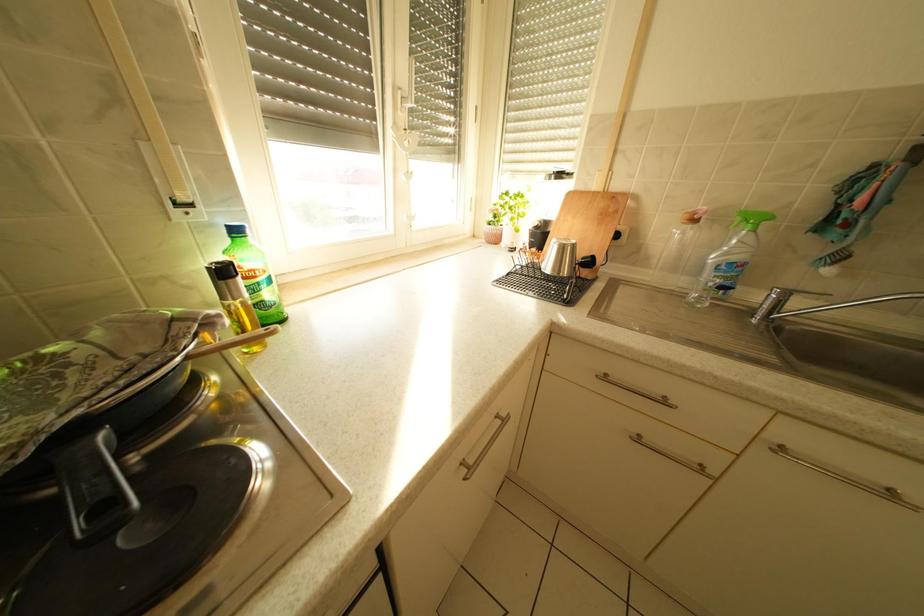
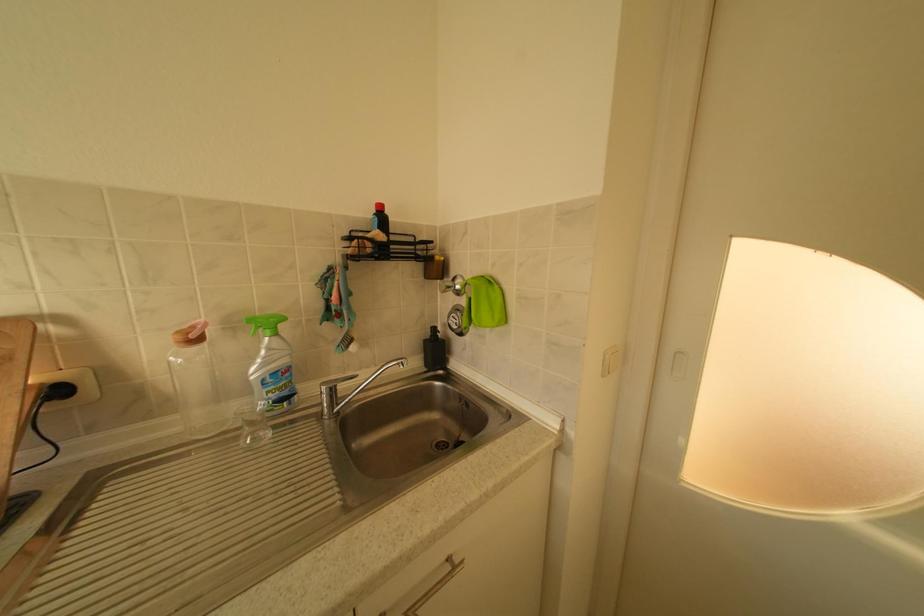
Question: Based on the continuous images, in which direction is the camera rotating? Reply with the corresponding letter.

Choices:
 (A) Left
 (B) Right
 (C) Up
 (D) Down

Answer: (B)